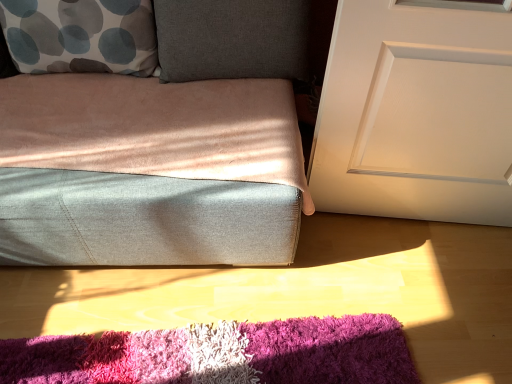
Find the location of a particular element. free location to the left of white matte door at right is located at coordinates (318, 262).